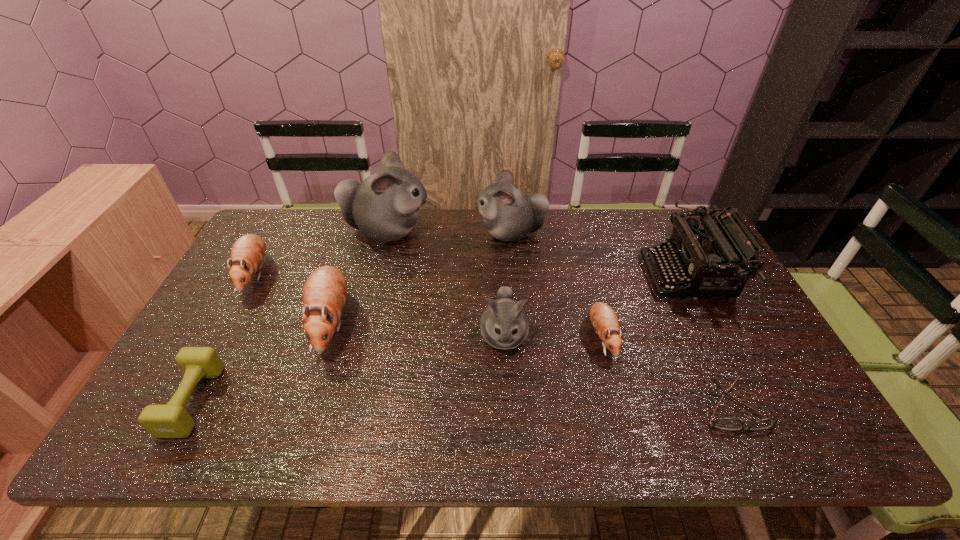
At what (x,y) coordinates should I click in order to perform the action: click on olive dumbbell. Please return your answer as a coordinate pair (x, y). This screenshot has height=540, width=960. Looking at the image, I should click on (171, 420).

This screenshot has height=540, width=960. I want to click on spectacles, so click(x=723, y=423).

This screenshot has width=960, height=540. Find the location of `vacant space located 0.090m on the face of the tallest hamster`. vacant space located 0.090m on the face of the tallest hamster is located at coordinates (457, 231).

Where is `free space located on the face of the fifth shortest hamster`? The height and width of the screenshot is (540, 960). free space located on the face of the fifth shortest hamster is located at coordinates (388, 233).

Find the location of a particular element. This screenshot has height=540, width=960. free space located on the face of the fifth shortest hamster is located at coordinates (452, 233).

The width and height of the screenshot is (960, 540). I want to click on vacant point located on the face of the fifth shortest hamster, so click(x=412, y=233).

Find the location of `vacant position located on the keyboard of the typewriter`. vacant position located on the keyboard of the typewriter is located at coordinates (540, 276).

The height and width of the screenshot is (540, 960). Find the location of `free space located on the keyboard of the typewriter`. free space located on the keyboard of the typewriter is located at coordinates (598, 276).

The width and height of the screenshot is (960, 540). I want to click on vacant space located 0.180m on the keyboard of the typewriter, so click(588, 276).

Where is `free space located 0.060m on the face of the smallest white hamster`? free space located 0.060m on the face of the smallest white hamster is located at coordinates (506, 384).